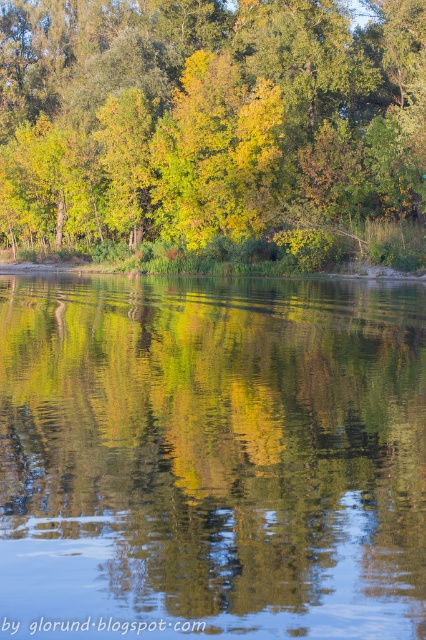
You are standing at the edge of the water and want to place a small floating decoration exactly at the center of the transparent water at center. According to the coordinates provided, where should you aim to place it?

The transparent water at center is located at coordinates point (212, 458), so you should aim to place the decoration there.

You are an artist trying to paint the scene. You want to place the transparent water at center in your painting. Where should you position it relative to the green leafy tree at upper center?

You should place the transparent water at center to the right of the green leafy tree at upper center as per the description.